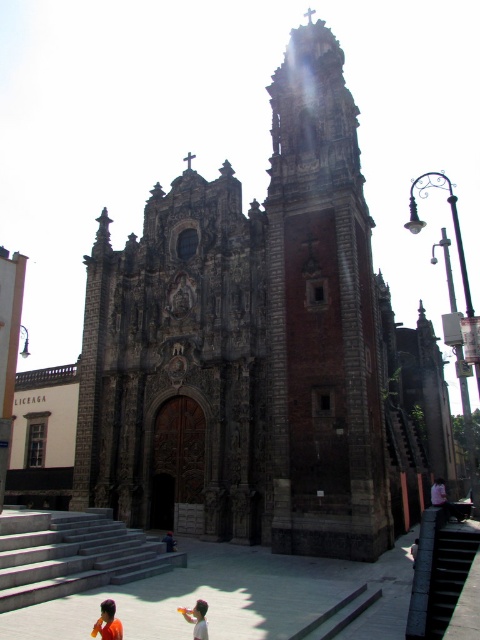
You are standing in front of the church and see the light yellow fabric at lower center and the orange fabric person at lower center. Which one appears larger in size?

The light yellow fabric at lower center is bigger than the orange fabric person at lower center.

You are standing in front of the church and want to locate the point at coordinates point (322, 316). Based on the scene description, where exactly is this point located?

The point (322, 316) is on the brick tower at center.